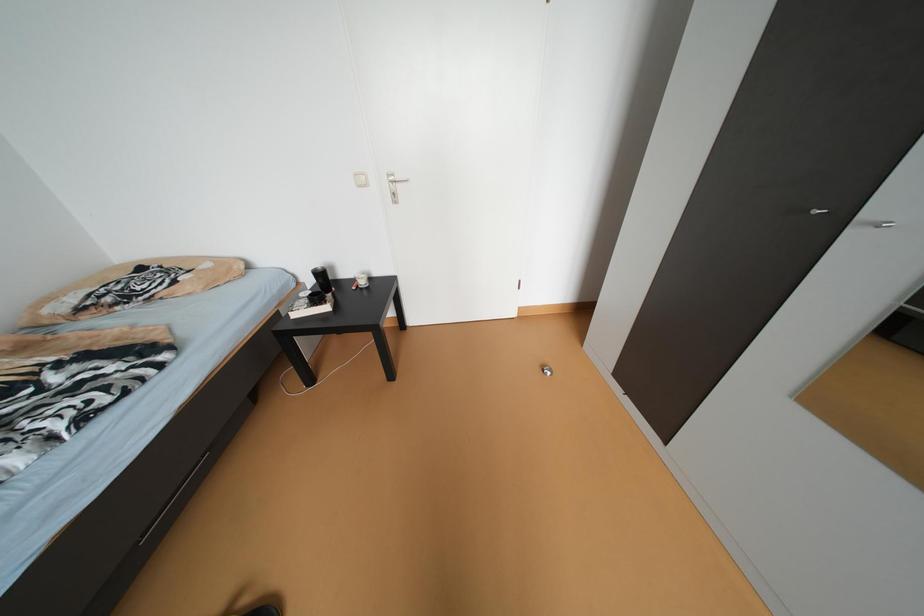
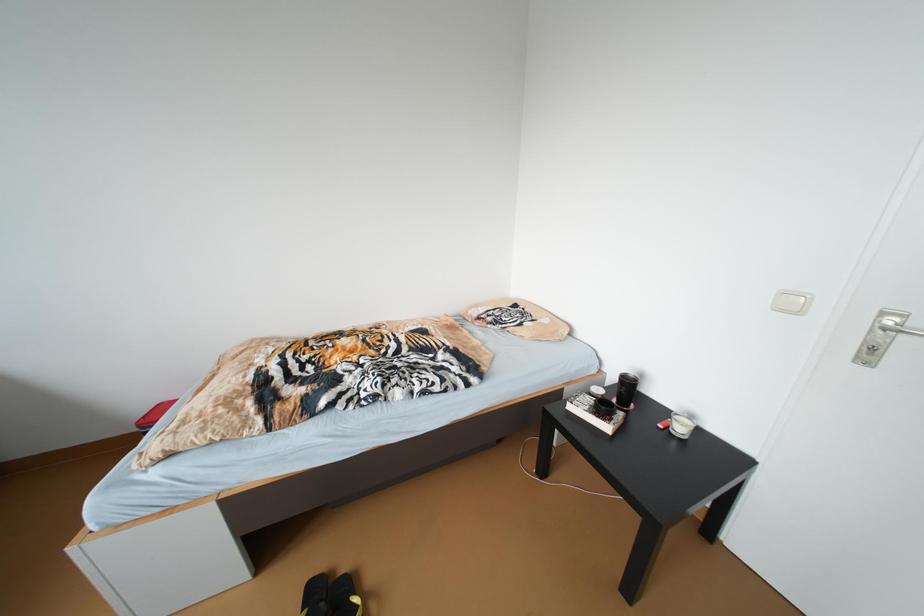
Question: The camera is either moving clockwise (left) or counter-clockwise (right) around the object. The first image is from the beginning of the video and the second image is from the end. Is the camera moving left or right when shooting the video?

Choices:
 (A) Left
 (B) Right

Answer: (B)